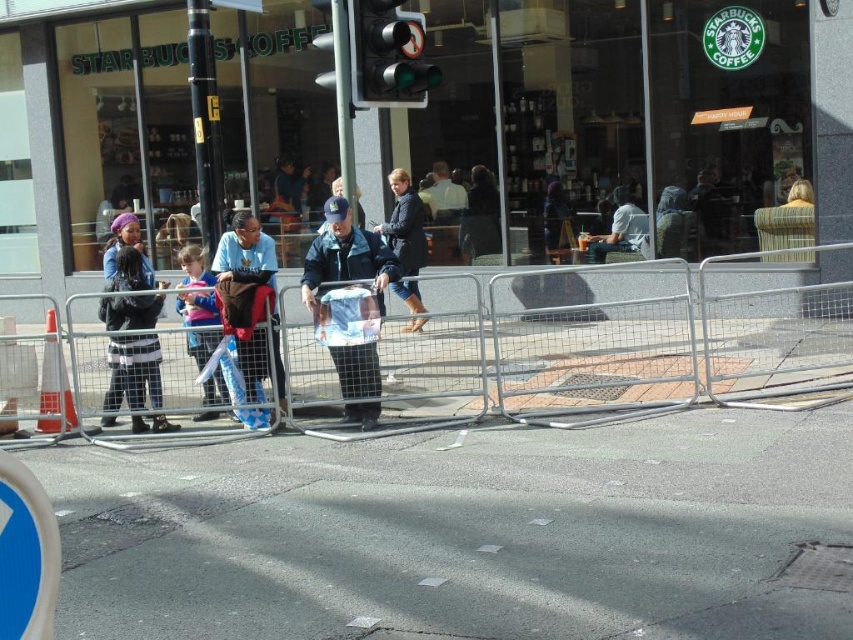
Question: Which object is positioned closest to the dark blue jacket at center?

Choices:
 (A) green glass traffic light at center
 (B) blue fabric jacket at center

Answer: (A)

Question: Does blue fabric jacket at center come in front of matte gray jacket at center?

Choices:
 (A) no
 (B) yes

Answer: (B)

Question: Considering the real-world distances, which object is closest to the matte gray jacket at center?

Choices:
 (A) gray asphalt pavement at center
 (B) blue fabric jacket at center

Answer: (B)

Question: Is blue denim jacket at center positioned before black leather jacket at left?

Choices:
 (A) yes
 (B) no

Answer: (A)

Question: Is silver metallic fence at center below dark blue jacket at center?

Choices:
 (A) no
 (B) yes

Answer: (B)

Question: Considering the real-world distances, which object is farthest from the green glass traffic light at center?

Choices:
 (A) dark blue leather jacket at center
 (B) matte gray jacket at center

Answer: (B)